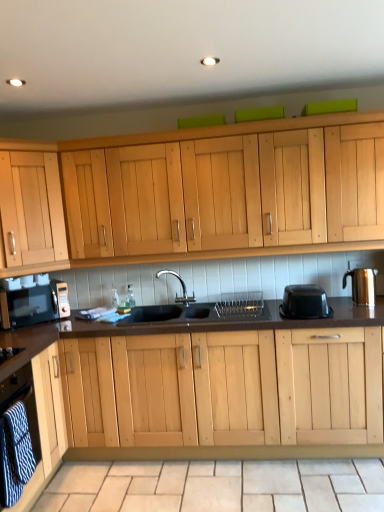
Question: From the image's perspective, would you say gold metallic kettle at right is shown under light wood cabinet at lower left, acting as the 2th cabinetry starting from the back?

Choices:
 (A) no
 (B) yes

Answer: (A)

Question: Is gold metallic kettle at right to the left of light wood cabinet at lower left, the first cabinetry ordered from the bottom, from the viewer's perspective?

Choices:
 (A) no
 (B) yes

Answer: (A)

Question: Is gold metallic kettle at right positioned with its back to light wood cabinet at lower left, which is the first cabinetry from front to back?

Choices:
 (A) yes
 (B) no

Answer: (B)

Question: Is gold metallic kettle at right aimed at light wood cabinet at lower left, acting as the 2th cabinetry starting from the back?

Choices:
 (A) no
 (B) yes

Answer: (A)

Question: Is gold metallic kettle at right outside light wood cabinet at lower left, placed as the 2th cabinetry when sorted from top to bottom?

Choices:
 (A) no
 (B) yes

Answer: (B)

Question: Can you confirm if gold metallic kettle at right is thinner than light wood cabinet at lower left, which is the first cabinetry from front to back?

Choices:
 (A) yes
 (B) no

Answer: (A)

Question: Does black matte sink at center have a lesser height compared to gold metallic kettle at right?

Choices:
 (A) yes
 (B) no

Answer: (B)

Question: Is black matte sink at center further to camera compared to gold metallic kettle at right?

Choices:
 (A) no
 (B) yes

Answer: (A)

Question: From the image's perspective, is black matte sink at center over gold metallic kettle at right?

Choices:
 (A) no
 (B) yes

Answer: (A)

Question: Considering the relative sizes of black matte sink at center and gold metallic kettle at right in the image provided, is black matte sink at center taller than gold metallic kettle at right?

Choices:
 (A) yes
 (B) no

Answer: (A)

Question: Is the position of black matte sink at center less distant than that of gold metallic kettle at right?

Choices:
 (A) yes
 (B) no

Answer: (A)

Question: From a real-world perspective, is black matte sink at center on top of gold metallic kettle at right?

Choices:
 (A) yes
 (B) no

Answer: (B)

Question: Is black plastic container at right a part of light wood cabinet at lower left, placed as the 2th cabinetry when sorted from top to bottom?

Choices:
 (A) yes
 (B) no

Answer: (B)